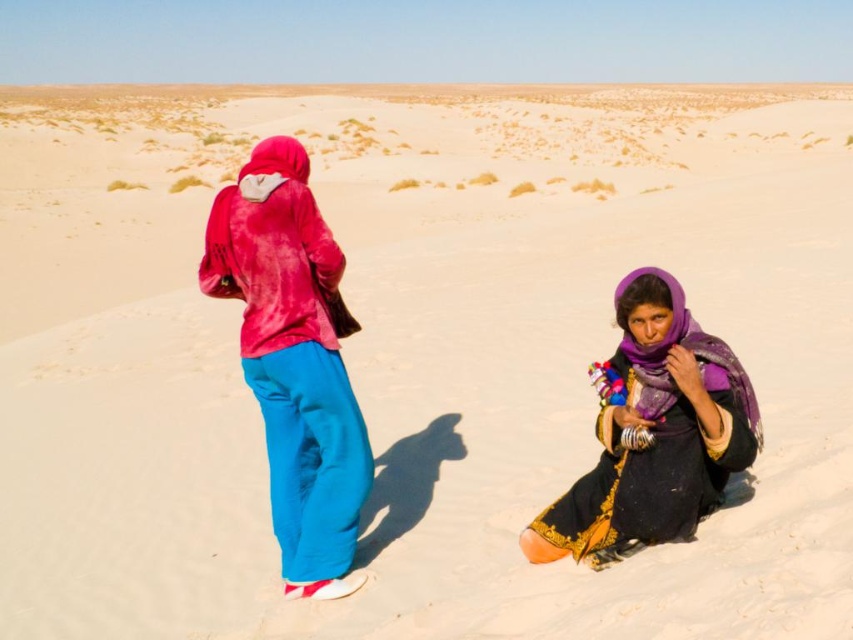
You are a photographer trying to capture a photo of the velvet red jacket at upper left and the purple satin scarf at lower right. Since you want both items to appear equally sized in the photo, which object should you move closer to and which should you move farther away?

The velvet red jacket at upper left is larger than the purple satin scarf at lower right. To make them appear the same size in the photo, move the velvet red jacket at upper left farther away and bring the purple satin scarf at lower right closer to the camera.

You are a photographer positioned at the center of the desert scene. You want to capture a photo of the velvet red jacket at upper left. Based on its coordinates, in which direction should you point your camera?

The velvet red jacket at upper left is located at coordinates point (293, 360), so you should point your camera to the upper left direction to capture it.